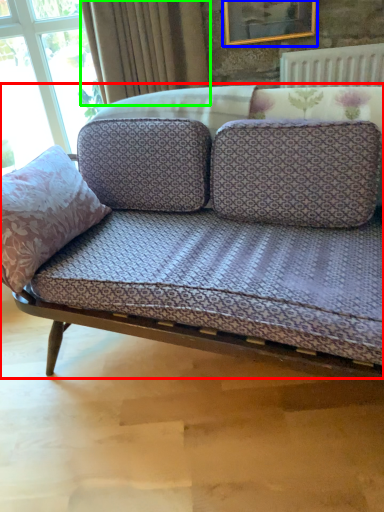
Question: Which is nearer to the studio couch (highlighted by a red box)? picture frame (highlighted by a blue box) or curtain (highlighted by a green box).

Choices:
 (A) picture frame
 (B) curtain

Answer: (B)